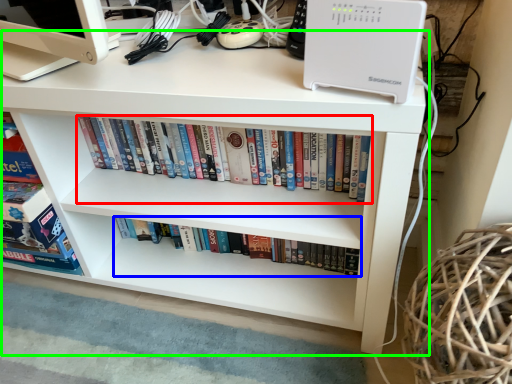
Question: Based on their relative distances, which object is nearer to book (highlighted by a red box)? Choose from book (highlighted by a blue box) and desk (highlighted by a green box).

Choices:
 (A) book
 (B) desk

Answer: (B)